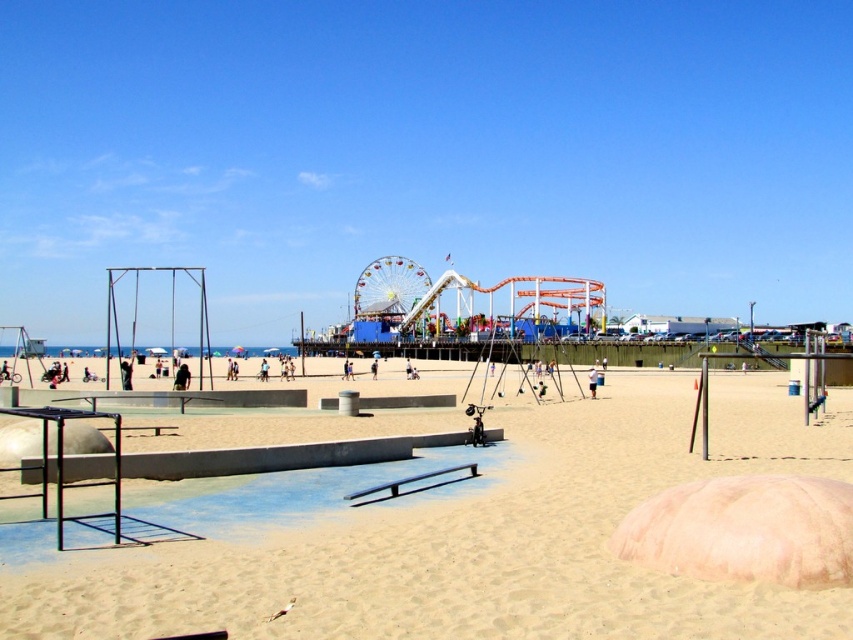
You are a photographer standing at the edge of the beach. You want to capture a photo that includes both the light brown sand at center and the multicolored metallic ferris wheel at center. Which object will appear larger in the photo?

The light brown sand at center will appear larger in the photo because it is closer to the viewer than the multicolored metallic ferris wheel at center.

You are standing at the edge of the beach and want to place a small flag exactly at the center of the light brown sand at center. According to the coordinates provided, where should you place the flag?

The flag should be placed at the coordinates point [479,541] where the light brown sand at center is located.

You are a child trying to build a sandcastle on the light brown sand at center. You also notice the multicolored metallic ferris wheel at center nearby. Which material would be easier to mold for the sandcastle?

The light brown sand at center has a smaller size, making it easier to mold for building a sandcastle compared to the multicolored metallic ferris wheel at center.